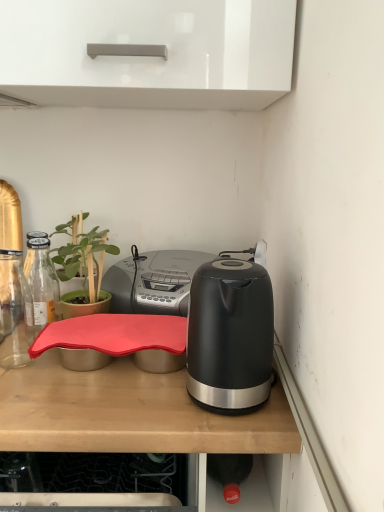
Question: In terms of size, does black glossy kettle at right appear bigger or smaller than rubberized red tray at center?

Choices:
 (A) big
 (B) small

Answer: (B)

Question: Is black glossy kettle at right to the left or to the right of rubberized red tray at center in the image?

Choices:
 (A) right
 (B) left

Answer: (A)

Question: Which object is positioned farthest from the black glossy kettle at right?

Choices:
 (A) matte black kettle at right
 (B) rubberized red tray at center
 (C) green matte plant at left

Answer: (C)

Question: Considering the real-world distances, which object is closest to the rubberized red tray at center?

Choices:
 (A) green matte plant at left
 (B) matte black kettle at right
 (C) black glossy kettle at right

Answer: (C)